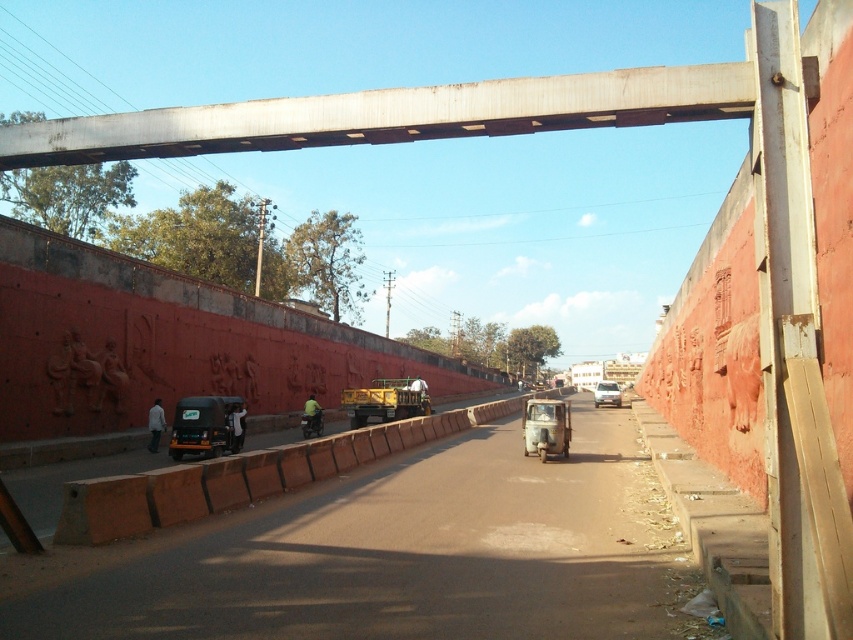
Which is more to the right, matte black auto-rickshaw at left or silver metallic sedan at center?

From the viewer's perspective, silver metallic sedan at center appears more on the right side.

Can you confirm if matte black auto-rickshaw at left is positioned below silver metallic sedan at center?

No, matte black auto-rickshaw at left is not below silver metallic sedan at center.

The image size is (853, 640). Identify the location of matte black auto-rickshaw at left. (204, 426).

Who is more distant from viewer, [39,573] or [314,422]?

Positioned behind is point [314,422].

Between brown concrete highway at center and green matte motorcycle at center, which one is positioned lower?

green matte motorcycle at center is lower down.

Locate an element on the screen. The image size is (853, 640). brown concrete highway at center is located at coordinates coord(395,556).

Who is shorter, brown concrete highway at center or brown concrete barrier at center?

brown concrete highway at center

Describe the element at coordinates (395, 556) in the screenshot. This screenshot has width=853, height=640. I see `brown concrete highway at center` at that location.

Which is behind, point (660, 600) or point (283, 476)?

Point (283, 476)

Locate an element on the screen. This screenshot has width=853, height=640. brown concrete highway at center is located at coordinates coord(395,556).